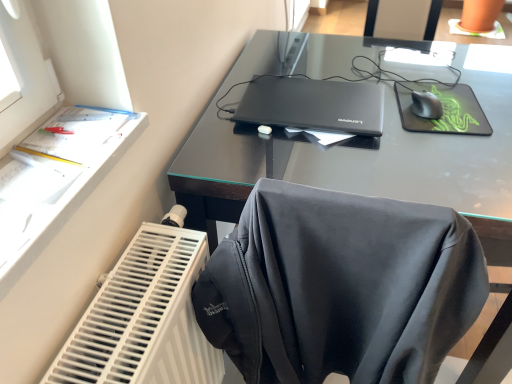
This screenshot has height=384, width=512. Identify the location of free point to the left of black matte laptop at center. (226, 118).